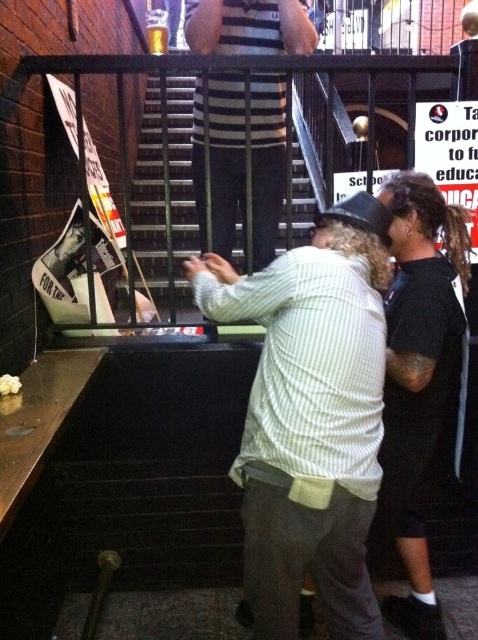
Between white striped shirt at center and striped shirt at center, which one has more height?

Standing taller between the two is white striped shirt at center.

Is white striped shirt at center smaller than striped shirt at center?

Correct, white striped shirt at center occupies less space than striped shirt at center.

Is point (344, 308) less distant than point (215, 196)?

Yes, it is.

Image resolution: width=478 pixels, height=640 pixels. Identify the location of white striped shirt at center. (311, 416).

Can you confirm if black cotton shirt at center is taller than metal stairs at center?

No, black cotton shirt at center is not taller than metal stairs at center.

Does point (384, 300) lie in front of point (275, 224)?

Yes, point (384, 300) is closer to viewer.

The image size is (478, 640). Find the location of `black cotton shirt at center`. black cotton shirt at center is located at coordinates (419, 381).

Image resolution: width=478 pixels, height=640 pixels. Describe the element at coordinates (311, 416) in the screenshot. I see `white striped shirt at center` at that location.

Between point (265, 388) and point (152, 163), which one is positioned in front?

Positioned in front is point (265, 388).

Between point (268, 566) and point (194, 214), which one is positioned behind?

The point (194, 214) is behind.

Where is `white striped shirt at center`? The image size is (478, 640). white striped shirt at center is located at coordinates (311, 416).